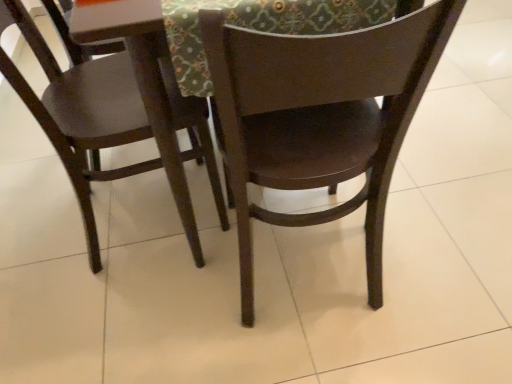
Describe the element at coordinates (319, 117) in the screenshot. The height and width of the screenshot is (384, 512). I see `dark wood chair at center, the first chair viewed from the right` at that location.

Identify the location of matte wood chair at left, which is counted as the first chair, starting from the left. Image resolution: width=512 pixels, height=384 pixels. (81, 112).

Measure the distance between point (382, 16) and camera.

The depth of point (382, 16) is 27.68 inches.

At what (x,y) coordinates should I click in order to perform the action: click on matte brown table at center. Please return your answer as a coordinate pair (x, y). The width and height of the screenshot is (512, 384). Looking at the image, I should click on (145, 84).

Considering the positions of objects matte wood chair at left, which ranks as the 2th chair in right-to-left order, and matte brown table at center in the image provided, who is behind, matte wood chair at left, which ranks as the 2th chair in right-to-left order, or matte brown table at center?

matte wood chair at left, which ranks as the 2th chair in right-to-left order, is behind.

Considering the sizes of matte wood chair at left, which ranks as the 2th chair in right-to-left order, and matte brown table at center in the image, is matte wood chair at left, which ranks as the 2th chair in right-to-left order, taller or shorter than matte brown table at center?

Clearly, matte wood chair at left, which ranks as the 2th chair in right-to-left order, is shorter compared to matte brown table at center.

From the image's perspective, would you say matte wood chair at left, which ranks as the 2th chair in right-to-left order, is positioned over matte brown table at center?

Answer: Incorrect, from the image's perspective, matte wood chair at left, which ranks as the 2th chair in right-to-left order, is lower than matte brown table at center.

Are matte wood chair at left, which ranks as the 2th chair in right-to-left order, and matte brown table at center located far from each other?

No, matte wood chair at left, which ranks as the 2th chair in right-to-left order, is not far from matte brown table at center.

From the image's perspective, is dark wood chair at center, arranged as the second chair when viewed from the left, above or below textured fabric at upper center?

From the image's perspective, dark wood chair at center, arranged as the second chair when viewed from the left, appears below textured fabric at upper center.

Is dark wood chair at center, the first chair viewed from the right, oriented away from textured fabric at upper center?

No, dark wood chair at center, the first chair viewed from the right,'s orientation is not away from textured fabric at upper center.

Is dark wood chair at center, arranged as the second chair when viewed from the left, at the right side of textured fabric at upper center?

Indeed, dark wood chair at center, arranged as the second chair when viewed from the left, is positioned on the right side of textured fabric at upper center.

Are matte brown table at center and matte wood chair at left, which ranks as the 2th chair in right-to-left order, beside each other?

matte brown table at center and matte wood chair at left, which ranks as the 2th chair in right-to-left order, are not in contact.

Is matte wood chair at left, which ranks as the 2th chair in right-to-left order, at the back of matte brown table at center?

Yes, matte brown table at center is positioned with its back facing matte wood chair at left, which ranks as the 2th chair in right-to-left order.

Is matte brown table at center wider or thinner than matte wood chair at left, which ranks as the 2th chair in right-to-left order?

Clearly, matte brown table at center has more width compared to matte wood chair at left, which ranks as the 2th chair in right-to-left order.

Can you confirm if matte brown table at center is positioned to the right of matte wood chair at left, which is counted as the first chair, starting from the left?

Yes, matte brown table at center is to the right of matte wood chair at left, which is counted as the first chair, starting from the left.

Is dark wood chair at center, arranged as the second chair when viewed from the left, wider or thinner than matte brown table at center?

Clearly, dark wood chair at center, arranged as the second chair when viewed from the left, has less width compared to matte brown table at center.

Does dark wood chair at center, the first chair viewed from the right, appear on the right side of matte brown table at center?

Indeed, dark wood chair at center, the first chair viewed from the right, is positioned on the right side of matte brown table at center.

Who is shorter, dark wood chair at center, the first chair viewed from the right, or matte brown table at center?

With less height is matte brown table at center.

Measure the distance between dark wood chair at center, arranged as the second chair when viewed from the left, and matte brown table at center.

dark wood chair at center, arranged as the second chair when viewed from the left, and matte brown table at center are 27.07 centimeters apart.

From the picture: Does matte brown table at center have a lesser height compared to dark wood chair at center, the first chair viewed from the right?

Indeed, matte brown table at center has a lesser height compared to dark wood chair at center, the first chair viewed from the right.

From the picture: From the image's perspective, which one is positioned lower, matte brown table at center or dark wood chair at center, arranged as the second chair when viewed from the left?

dark wood chair at center, arranged as the second chair when viewed from the left, appears lower in the image.

Considering the relative positions of matte brown table at center and dark wood chair at center, arranged as the second chair when viewed from the left, in the image provided, is matte brown table at center to the left or to the right of dark wood chair at center, arranged as the second chair when viewed from the left,?

matte brown table at center is to the left of dark wood chair at center, arranged as the second chair when viewed from the left.

Considering the sizes of objects textured fabric at upper center and matte brown table at center in the image provided, who is wider, textured fabric at upper center or matte brown table at center?

Wider between the two is matte brown table at center.

From a real-world perspective, is textured fabric at upper center above or below matte brown table at center?

textured fabric at upper center is above matte brown table at center.

Is point (168, 20) closer to viewer compared to point (151, 17)?

No, (168, 20) is further to viewer.

Is textured fabric at upper center facing towards matte wood chair at left, which ranks as the 2th chair in right-to-left order?

No, textured fabric at upper center is not aimed at matte wood chair at left, which ranks as the 2th chair in right-to-left order.

Considering the points (324, 7) and (218, 190), which point is behind, point (324, 7) or point (218, 190)?

The point (218, 190) is behind.

Is textured fabric at upper center shorter than matte wood chair at left, which is counted as the first chair, starting from the left?

Indeed, textured fabric at upper center has a lesser height compared to matte wood chair at left, which is counted as the first chair, starting from the left.

You are a GUI agent. You are given a task and a screenshot of the screen. Output one action in this format:
    pyautogui.click(x=<x>, y=<y>)
    Task: Click on the round table in front of the matte wood chair at left, which ranks as the 2th chair in right-to-left order
    
    Given the screenshot: What is the action you would take?
    pyautogui.click(x=145, y=84)

I want to click on chair that is the 1st object directly below the textured fabric at upper center (from a real-world perspective), so click(x=319, y=117).

Looking at this image, looking at the image, which one is located further to textured fabric at upper center, matte wood chair at left, which ranks as the 2th chair in right-to-left order, or matte brown table at center?

Based on the image, matte wood chair at left, which ranks as the 2th chair in right-to-left order, appears to be further to textured fabric at upper center.

Estimate the real-world distances between objects in this image. Which object is closer to textured fabric at upper center, matte brown table at center or dark wood chair at center, the first chair viewed from the right?

matte brown table at center.

From the image, which object appears to be nearer to matte brown table at center, matte wood chair at left, which ranks as the 2th chair in right-to-left order, or dark wood chair at center, the first chair viewed from the right?

The object closer to matte brown table at center is matte wood chair at left, which ranks as the 2th chair in right-to-left order.

Which object lies nearer to the anchor point textured fabric at upper center, matte brown table at center or matte wood chair at left, which ranks as the 2th chair in right-to-left order?

matte brown table at center.

From the image, which object appears to be nearer to dark wood chair at center, arranged as the second chair when viewed from the left, matte brown table at center or textured fabric at upper center?

textured fabric at upper center.

Based on their spatial positions, is textured fabric at upper center or matte wood chair at left, which ranks as the 2th chair in right-to-left order, closer to dark wood chair at center, arranged as the second chair when viewed from the left?

Among the two, textured fabric at upper center is located nearer to dark wood chair at center, arranged as the second chair when viewed from the left.

Based on their spatial positions, is matte wood chair at left, which ranks as the 2th chair in right-to-left order, or dark wood chair at center, arranged as the second chair when viewed from the left, further from textured fabric at upper center?

Based on the image, matte wood chair at left, which ranks as the 2th chair in right-to-left order, appears to be further to textured fabric at upper center.

When comparing their distances from matte wood chair at left, which ranks as the 2th chair in right-to-left order, does textured fabric at upper center or dark wood chair at center, arranged as the second chair when viewed from the left, seem closer?

Among the two, dark wood chair at center, arranged as the second chair when viewed from the left, is located nearer to matte wood chair at left, which ranks as the 2th chair in right-to-left order.

Identify the location of tablecloth between matte brown table at center and dark wood chair at center, arranged as the second chair when viewed from the left, vertically. (260, 27).

Identify the location of round table located between matte wood chair at left, which is counted as the first chair, starting from the left, and dark wood chair at center, arranged as the second chair when viewed from the left, in the left-right direction. The image size is (512, 384). (145, 84).

Locate an element on the screen. The image size is (512, 384). tablecloth between matte wood chair at left, which is counted as the first chair, starting from the left, and dark wood chair at center, the first chair viewed from the right, in the horizontal direction is located at coordinates 260,27.

Find the location of a particular element. round table between matte wood chair at left, which is counted as the first chair, starting from the left, and textured fabric at upper center from left to right is located at coordinates (145, 84).